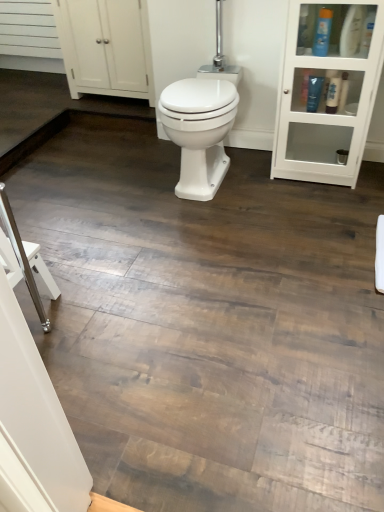
Identify the location of blank space above white glossy bidet at center (from a real-world perspective). (203, 90).